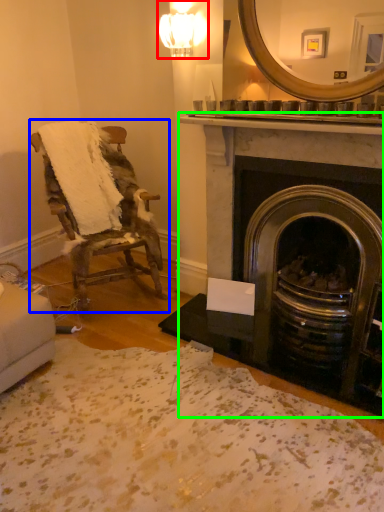
Question: Based on their relative distances, which object is farther from light fixture (highlighted by a red box)? Choose from chair (highlighted by a blue box) and fireplace (highlighted by a green box).

Choices:
 (A) chair
 (B) fireplace

Answer: (A)